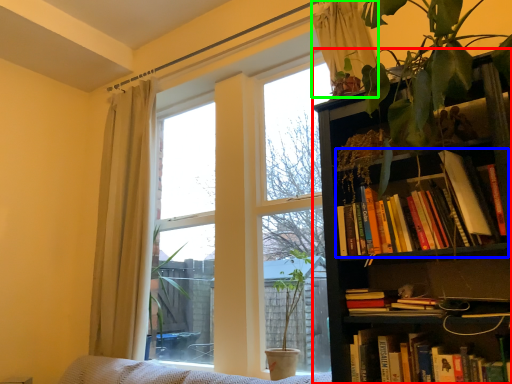
Question: Which is nearer to the bookcase (highlighted by a red box)? book (highlighted by a blue box) or curtain (highlighted by a green box).

Choices:
 (A) book
 (B) curtain

Answer: (A)